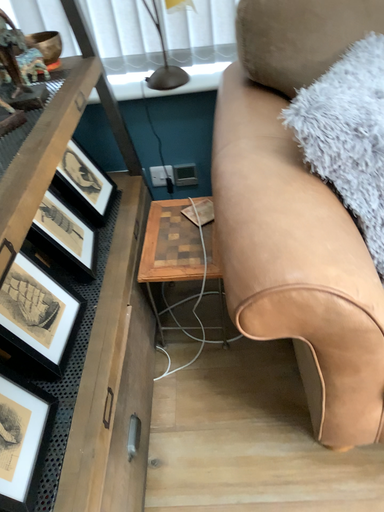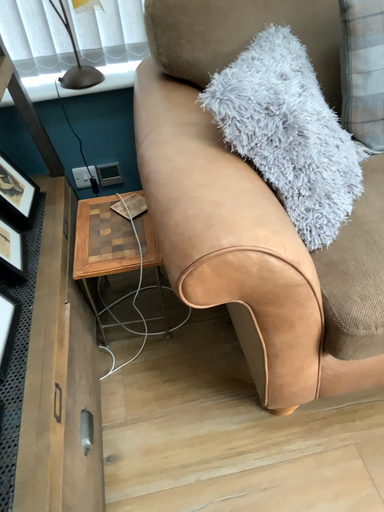
Question: Which way did the camera rotate in the video?

Choices:
 (A) rotated right
 (B) rotated left

Answer: (A)